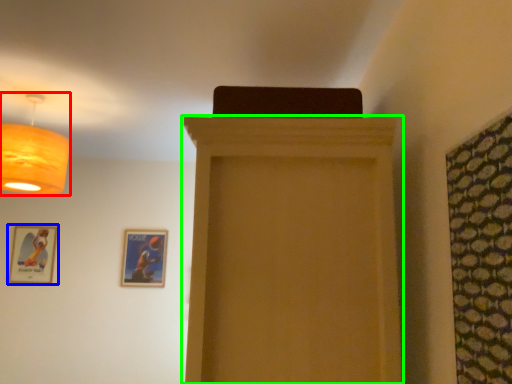
Question: Estimate the real-world distances between objects in this image. Which object is farther from lamp (highlighted by a red box), picture frame (highlighted by a blue box) or furniture (highlighted by a green box)?

Choices:
 (A) picture frame
 (B) furniture

Answer: (A)